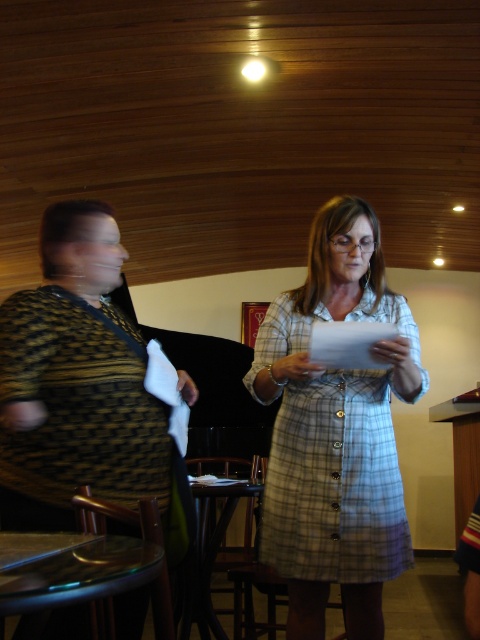
Question: Is plaid cotton dress at center smaller than white paper at center?

Choices:
 (A) no
 (B) yes

Answer: (A)

Question: Estimate the real-world distances between objects in this image. Which object is closer to the white paper at center?

Choices:
 (A) plaid cotton dress at center
 (B) patterned fabric dress at left

Answer: (A)

Question: Is plaid cotton dress at center closer to the viewer compared to patterned fabric dress at left?

Choices:
 (A) yes
 (B) no

Answer: (B)

Question: Which object appears closest to the camera in this image?

Choices:
 (A) plaid cotton dress at center
 (B) patterned fabric dress at left
 (C) white paper at center

Answer: (B)

Question: Which of these objects is positioned farthest from the plaid cotton dress at center?

Choices:
 (A) patterned fabric dress at left
 (B) white paper at center

Answer: (A)

Question: Is plaid cotton dress at center wider than patterned fabric dress at left?

Choices:
 (A) no
 (B) yes

Answer: (B)